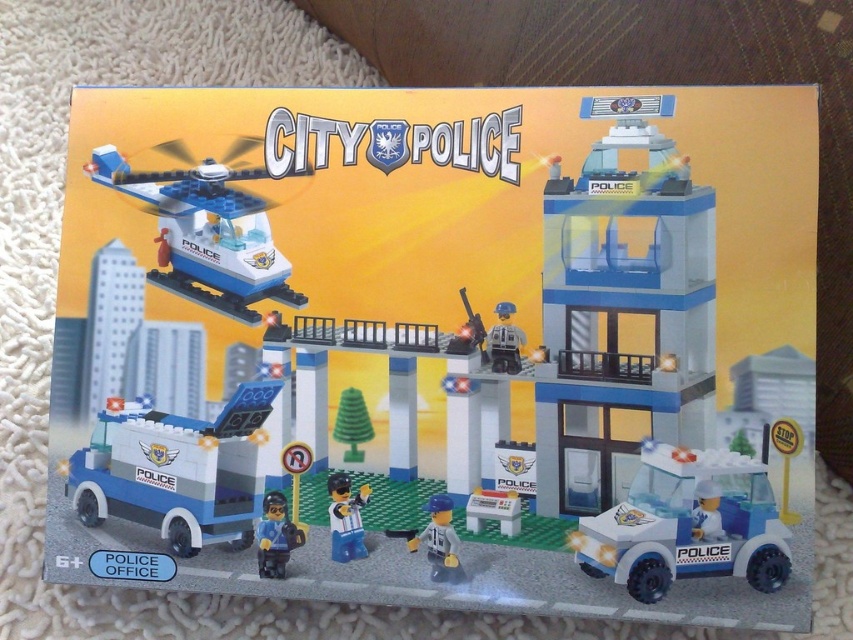
You are designing a display for a toy store and need to place the blue plastic police van at lower left and the blue plastic helicopter at upper left on a shelf. The shelf has a height limit of 6 inches. Can both items be placed without exceeding the height limit?

The distance between the blue plastic police van at lower left and the blue plastic helicopter at upper left is 6.36 inches. Since the shelf has a height limit of 6 inches, placing both items would exceed the height limit by 0.36 inches.